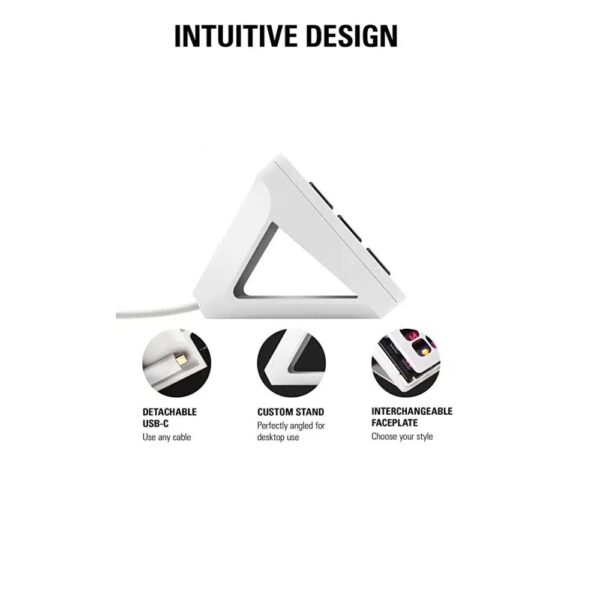
The image size is (600, 600). Find the location of `side of tablet stand`. side of tablet stand is located at coordinates (280, 367), (228, 272).